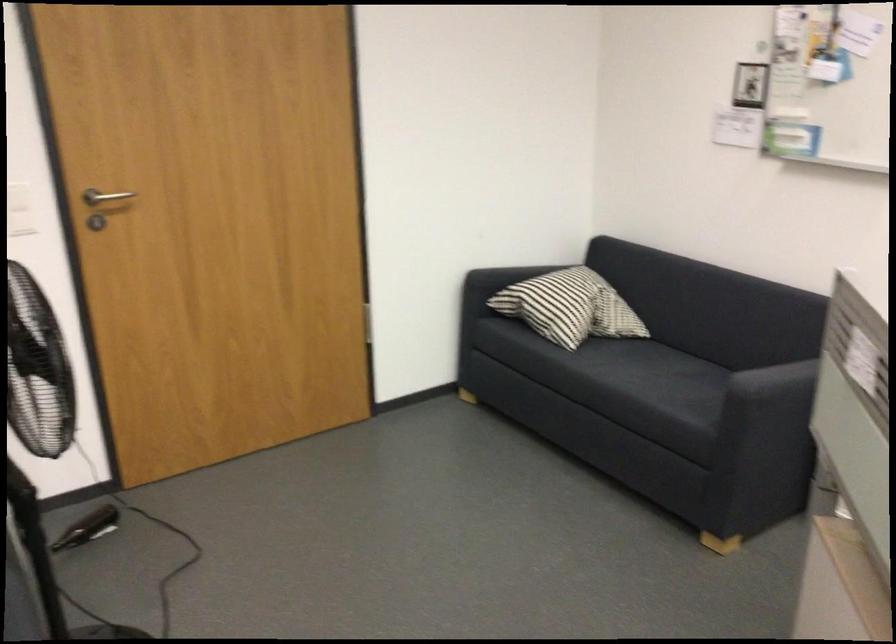
What do you see at coordinates (105, 196) in the screenshot?
I see `a silver door handle` at bounding box center [105, 196].